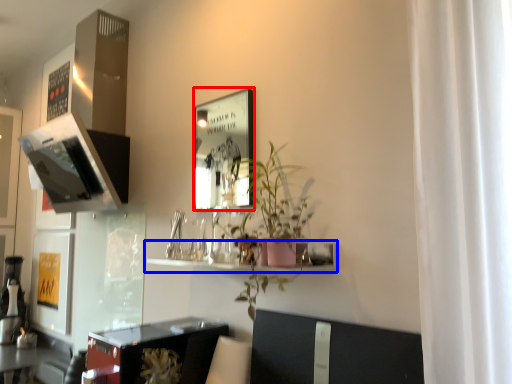
Question: Which of the following is the closest to the observer, picture frame (highlighted by a red box) or shelf (highlighted by a blue box)?

Choices:
 (A) picture frame
 (B) shelf

Answer: (B)